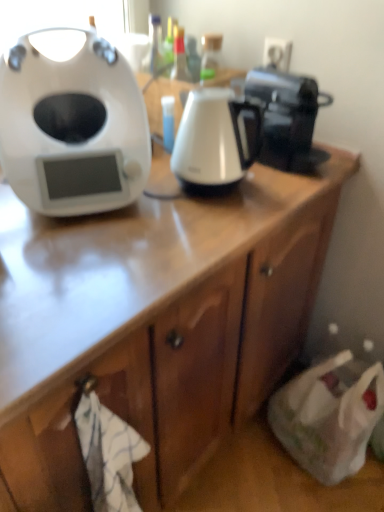
Question: Considering the relative sizes of black glossy coffee maker at upper right and white glossy electric kettle at center in the image provided, is black glossy coffee maker at upper right smaller than white glossy electric kettle at center?

Choices:
 (A) yes
 (B) no

Answer: (B)

Question: From the image's perspective, would you say black glossy coffee maker at upper right is shown under white glossy electric kettle at center?

Choices:
 (A) no
 (B) yes

Answer: (A)

Question: Can you see black glossy coffee maker at upper right touching white glossy electric kettle at center?

Choices:
 (A) yes
 (B) no

Answer: (B)

Question: Is black glossy coffee maker at upper right to the left of white glossy electric kettle at center from the viewer's perspective?

Choices:
 (A) no
 (B) yes

Answer: (A)

Question: Is the position of black glossy coffee maker at upper right less distant than that of white glossy electric kettle at center?

Choices:
 (A) no
 (B) yes

Answer: (A)

Question: From a real-world perspective, is black glossy coffee maker at upper right positioned above or below white glossy electric kettle at center?

Choices:
 (A) below
 (B) above

Answer: (B)

Question: Considering the positions of black glossy coffee maker at upper right and white glossy electric kettle at center in the image, is black glossy coffee maker at upper right taller or shorter than white glossy electric kettle at center?

Choices:
 (A) short
 (B) tall

Answer: (A)

Question: Considering the positions of black glossy coffee maker at upper right and white glossy electric kettle at center in the image, is black glossy coffee maker at upper right bigger or smaller than white glossy electric kettle at center?

Choices:
 (A) small
 (B) big

Answer: (B)

Question: Relative to white glossy electric kettle at center, is black glossy coffee maker at upper right in front or behind?

Choices:
 (A) front
 (B) behind

Answer: (B)

Question: Choose the correct answer: Is black glossy coffee maker at upper right inside white matte/soft plastic at left or outside it?

Choices:
 (A) inside
 (B) outside

Answer: (B)

Question: Considering the positions of black glossy coffee maker at upper right and white matte/soft plastic at left in the image, is black glossy coffee maker at upper right wider or thinner than white matte/soft plastic at left?

Choices:
 (A) wide
 (B) thin

Answer: (A)

Question: Is point (294, 157) closer or farther from the camera than point (77, 113)?

Choices:
 (A) farther
 (B) closer

Answer: (A)

Question: Considering the relative positions of black glossy coffee maker at upper right and white matte/soft plastic at left in the image provided, is black glossy coffee maker at upper right to the left or to the right of white matte/soft plastic at left?

Choices:
 (A) right
 (B) left

Answer: (A)

Question: From a real-world perspective, is white glossy electric kettle at center physically located above or below white matte/soft plastic at left?

Choices:
 (A) above
 (B) below

Answer: (B)

Question: Considering the positions of white glossy electric kettle at center and white matte/soft plastic at left in the image, is white glossy electric kettle at center bigger or smaller than white matte/soft plastic at left?

Choices:
 (A) small
 (B) big

Answer: (A)